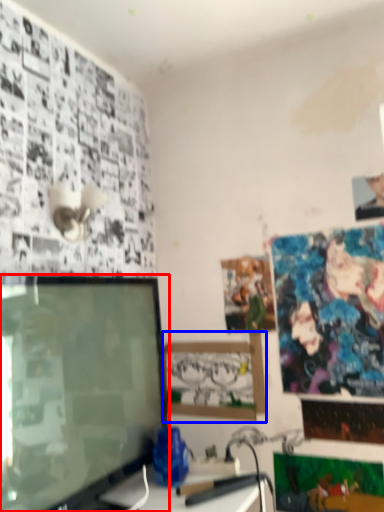
Question: Which object appears farthest to the camera in this image, television (highlighted by a red box) or picture frame (highlighted by a blue box)?

Choices:
 (A) television
 (B) picture frame

Answer: (B)